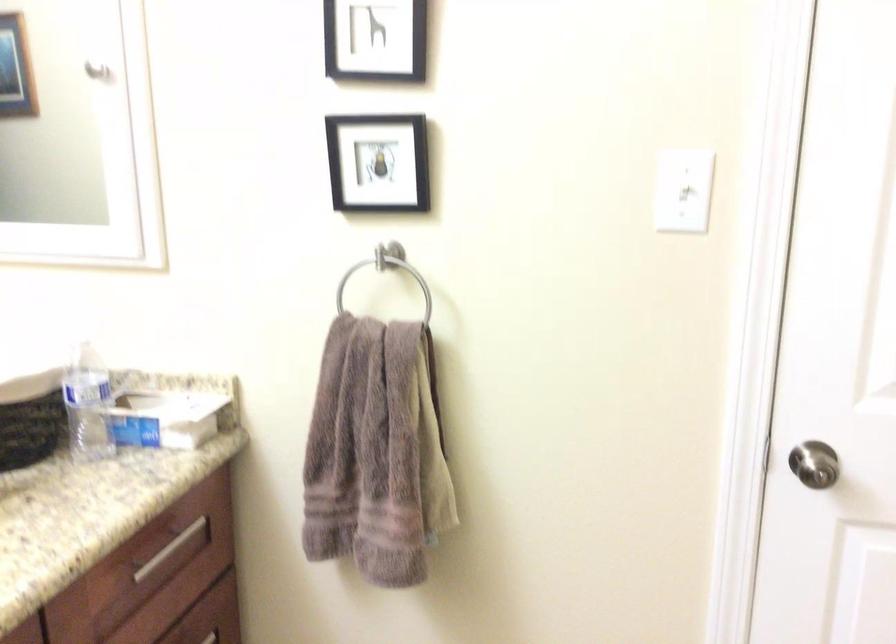
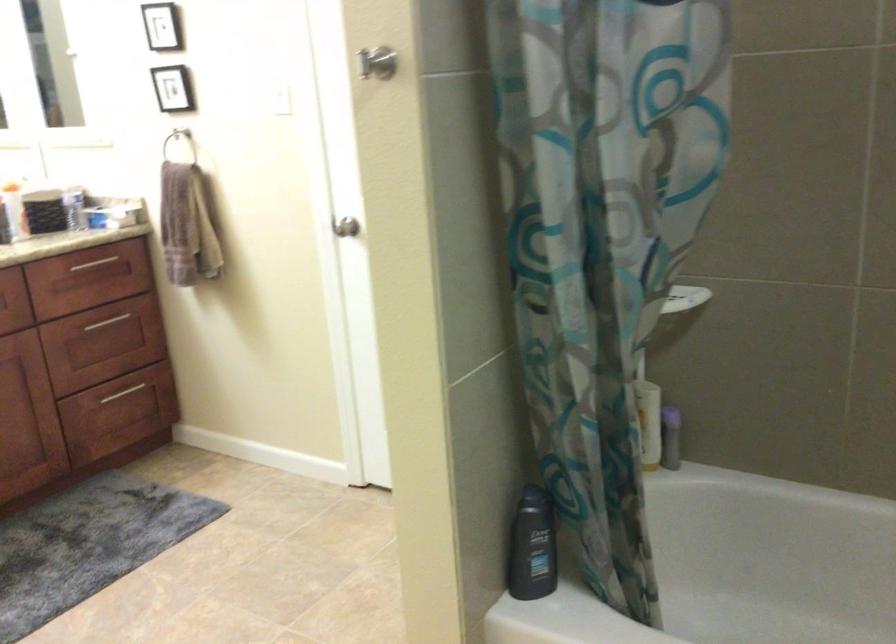
Where in the second image is the point corresponding to (x=154, y=561) from the first image?

(92, 263)